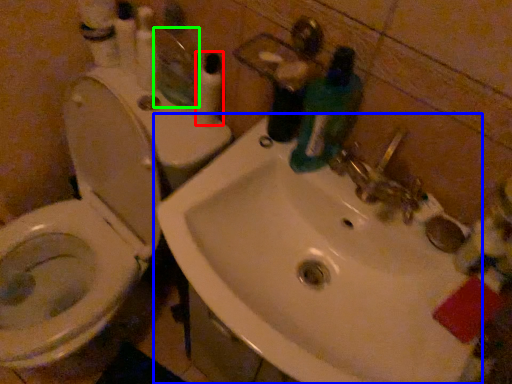
Question: Considering the real-world distances, which object is farthest from toiletry (highlighted by a red box)? sink (highlighted by a blue box) or mirror (highlighted by a green box)?

Choices:
 (A) sink
 (B) mirror

Answer: (A)